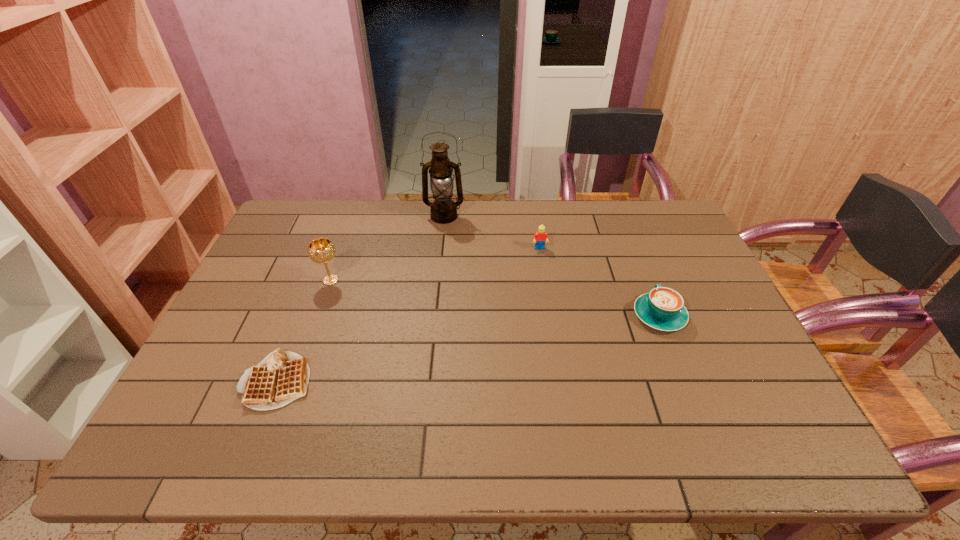
Where is `free space located on the right of the farthest object`? free space located on the right of the farthest object is located at coordinates (568, 217).

Locate an element on the screen. This screenshot has height=540, width=960. vacant space positioned on the right of the fourth shortest object is located at coordinates (476, 280).

Find the location of a particular element. vacant space located 0.150m on the face of the third shortest object is located at coordinates (545, 284).

Locate an element on the screen. This screenshot has height=540, width=960. vacant region located with the handle on the right side of the second shortest object is located at coordinates (625, 228).

Where is `blank space located 0.350m with the handle on the right side of the second shortest object`? Image resolution: width=960 pixels, height=540 pixels. blank space located 0.350m with the handle on the right side of the second shortest object is located at coordinates (623, 225).

Where is `vacant region located with the handle on the right side of the second shortest object`? vacant region located with the handle on the right side of the second shortest object is located at coordinates (620, 218).

Identify the location of vacant space located 0.070m on the front of the shortest object. This screenshot has height=540, width=960. (253, 442).

Find the location of a particular element. object located in the far edge section of the desktop is located at coordinates (443, 209).

The width and height of the screenshot is (960, 540). I want to click on object that is positioned at the left edge, so click(x=281, y=377).

I want to click on object situated at the right edge, so click(x=663, y=308).